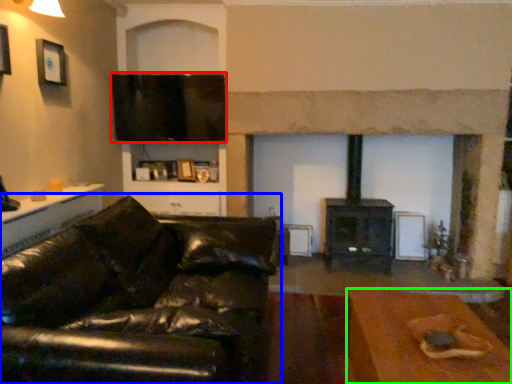
Question: Based on their relative distances, which object is nearer to window screen (highlighted by a red box)? Choose from studio couch (highlighted by a blue box) and table (highlighted by a green box).

Choices:
 (A) studio couch
 (B) table

Answer: (A)